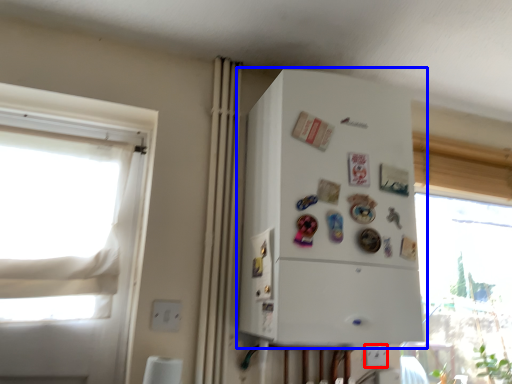
Question: Which object is closer to the camera taking this photo, electric outlet (highlighted by a red box) or refrigerator (highlighted by a blue box)?

Choices:
 (A) electric outlet
 (B) refrigerator

Answer: (B)